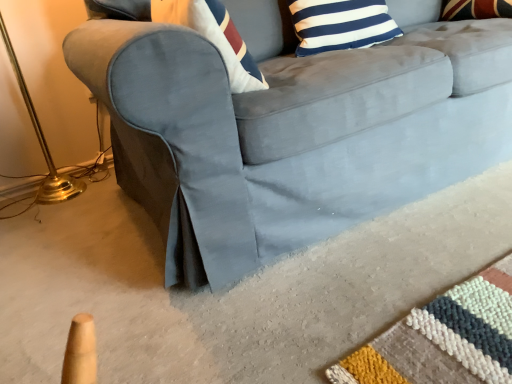
Question: Considering the relative positions of blue and white striped pillow at upper center and suede gray couch at center in the image provided, is blue and white striped pillow at upper center to the left of suede gray couch at center from the viewer's perspective?

Choices:
 (A) yes
 (B) no

Answer: (A)

Question: Is the depth of blue and white striped pillow at upper center greater than that of suede gray couch at center?

Choices:
 (A) no
 (B) yes

Answer: (B)

Question: Is blue and white striped pillow at upper center smaller than suede gray couch at center?

Choices:
 (A) no
 (B) yes

Answer: (B)

Question: Is blue and white striped pillow at upper center facing away from suede gray couch at center?

Choices:
 (A) yes
 (B) no

Answer: (A)

Question: From a real-world perspective, is blue and white striped pillow at upper center over suede gray couch at center?

Choices:
 (A) yes
 (B) no

Answer: (A)

Question: Considering the relative positions of suede gray couch at center and gold metallic table lamp at left in the image provided, is suede gray couch at center to the left or to the right of gold metallic table lamp at left?

Choices:
 (A) right
 (B) left

Answer: (A)

Question: Is suede gray couch at center taller or shorter than gold metallic table lamp at left?

Choices:
 (A) tall
 (B) short

Answer: (B)

Question: Considering their positions, is suede gray couch at center located in front of or behind gold metallic table lamp at left?

Choices:
 (A) behind
 (B) front

Answer: (B)

Question: Does point (105, 59) appear closer or farther from the camera than point (52, 192)?

Choices:
 (A) closer
 (B) farther

Answer: (A)

Question: Would you say suede gray couch at center is inside or outside blue and white striped pillow at upper center?

Choices:
 (A) inside
 (B) outside

Answer: (B)

Question: Looking at their shapes, would you say suede gray couch at center is wider or thinner than blue and white striped pillow at upper center?

Choices:
 (A) wide
 (B) thin

Answer: (A)

Question: Based on their positions, is suede gray couch at center located to the left or right of blue and white striped pillow at upper center?

Choices:
 (A) left
 (B) right

Answer: (B)

Question: From the image's perspective, is suede gray couch at center above or below blue and white striped pillow at upper center?

Choices:
 (A) above
 (B) below

Answer: (B)

Question: Is blue and white striped pillow at upper center bigger or smaller than gold metallic table lamp at left?

Choices:
 (A) big
 (B) small

Answer: (B)

Question: Looking at their shapes, would you say blue and white striped pillow at upper center is wider or thinner than gold metallic table lamp at left?

Choices:
 (A) thin
 (B) wide

Answer: (A)